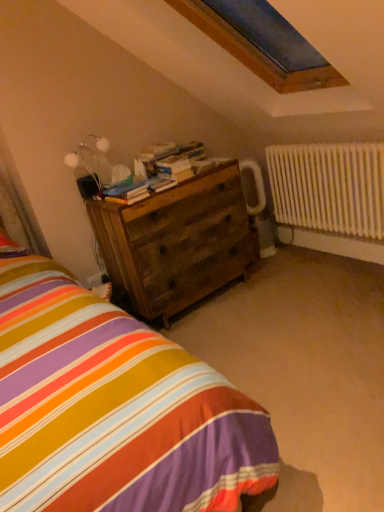
Question: Is wooden chest of drawers at center looking in the opposite direction of striped fabric bed at lower left?

Choices:
 (A) yes
 (B) no

Answer: (B)

Question: Is wooden chest of drawers at center wider than striped fabric bed at lower left?

Choices:
 (A) yes
 (B) no

Answer: (B)

Question: Are wooden chest of drawers at center and striped fabric bed at lower left beside each other?

Choices:
 (A) no
 (B) yes

Answer: (A)

Question: Is there a large distance between wooden chest of drawers at center and striped fabric bed at lower left?

Choices:
 (A) yes
 (B) no

Answer: (B)

Question: From a real-world perspective, is wooden chest of drawers at center positioned under striped fabric bed at lower left based on gravity?

Choices:
 (A) no
 (B) yes

Answer: (A)

Question: Is wooden chest of drawers at center smaller than striped fabric bed at lower left?

Choices:
 (A) no
 (B) yes

Answer: (A)

Question: Can you confirm if wooden books at center, which is the 1th book from front to back, is positioned to the right of metallic silver table lamp at upper left?

Choices:
 (A) no
 (B) yes

Answer: (B)

Question: Is wooden books at center, which appears as the 2th book when viewed from the top, at the left side of metallic silver table lamp at upper left?

Choices:
 (A) yes
 (B) no

Answer: (B)

Question: Can you confirm if wooden books at center, the 1th book positioned from the bottom, is thinner than metallic silver table lamp at upper left?

Choices:
 (A) no
 (B) yes

Answer: (A)

Question: Are wooden books at center, which is the 1th book from front to back, and metallic silver table lamp at upper left far apart?

Choices:
 (A) no
 (B) yes

Answer: (A)

Question: Is wooden books at center, which appears as the 2th book when viewed from the top, smaller than metallic silver table lamp at upper left?

Choices:
 (A) no
 (B) yes

Answer: (B)

Question: From a real-world perspective, is wooden books at center, the 1th book positioned from the bottom, beneath metallic silver table lamp at upper left?

Choices:
 (A) no
 (B) yes

Answer: (B)

Question: From a real-world perspective, is wooden books at center, the 1th book viewed from the back, on top of wooden chest of drawers at center?

Choices:
 (A) no
 (B) yes

Answer: (B)